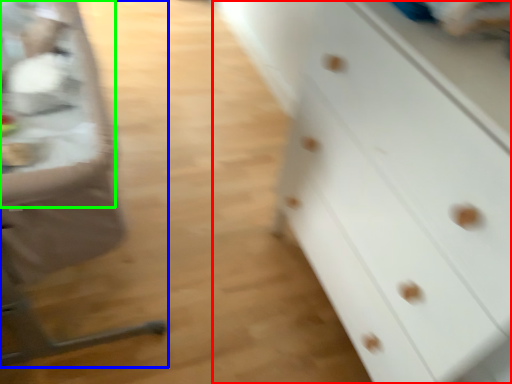
Question: Based on their relative distances, which object is farther from chest of drawers (highlighted by a red box)? Choose from feeding chair (highlighted by a blue box) and table (highlighted by a green box).

Choices:
 (A) feeding chair
 (B) table

Answer: (B)